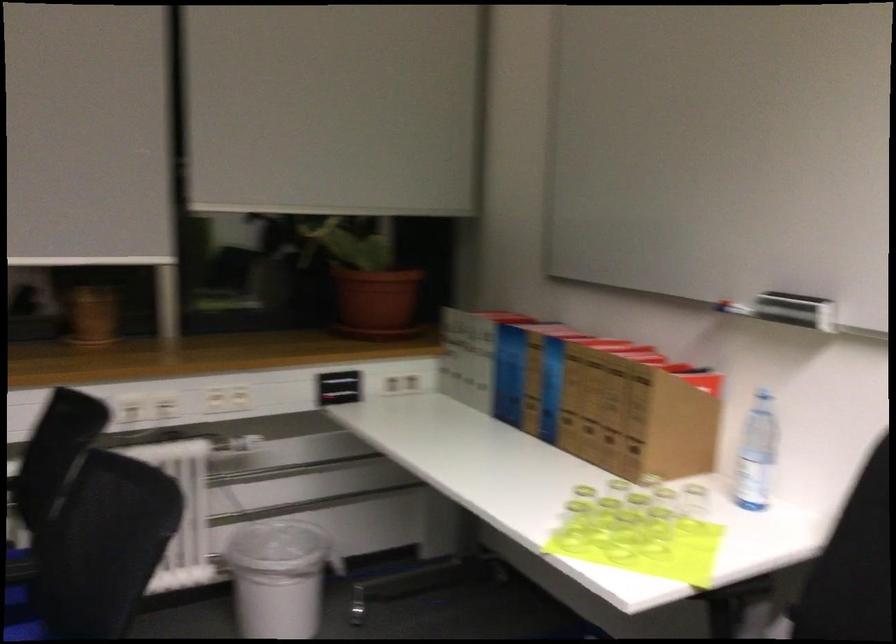
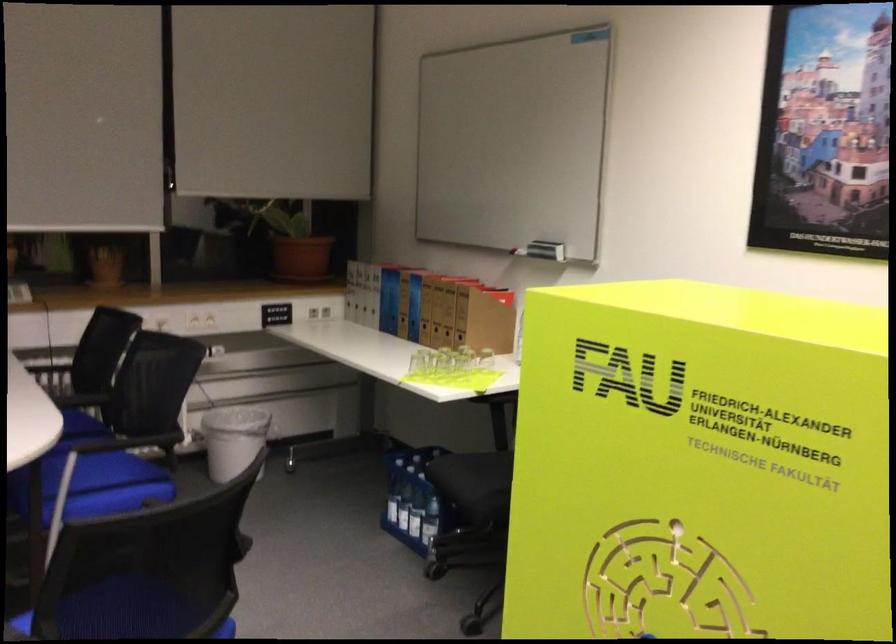
Question: I am providing you with two images of the same scene from different viewpoints. After the viewpoint changes to image2, which objects are now occluded?

Choices:
 (A) refrigerator lock key
 (B) plastic water bottle
 (C) blue chair sitting surface
 (D) blue binder spine hole

Answer: (B)